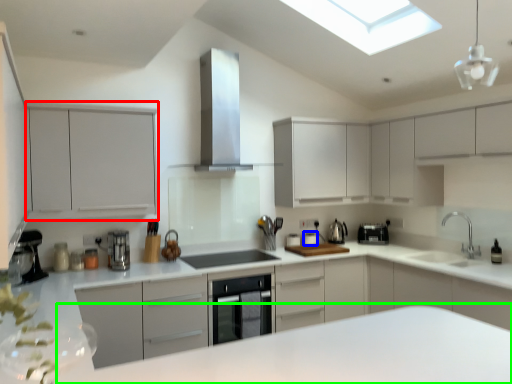
Question: Estimate the real-world distances between objects in this image. Which object is farther from cabinetry (highlighted by a red box), appliance (highlighted by a blue box) or counter (highlighted by a green box)?

Choices:
 (A) appliance
 (B) counter

Answer: (B)